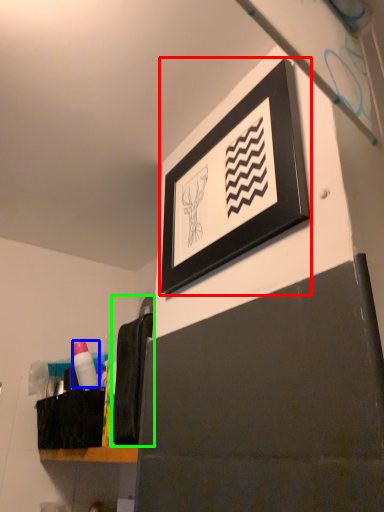
Question: Estimate the real-world distances between objects in this image. Which object is farther from picture frame (highlighted by a red box), toiletry (highlighted by a blue box) or laundry (highlighted by a green box)?

Choices:
 (A) toiletry
 (B) laundry

Answer: (A)